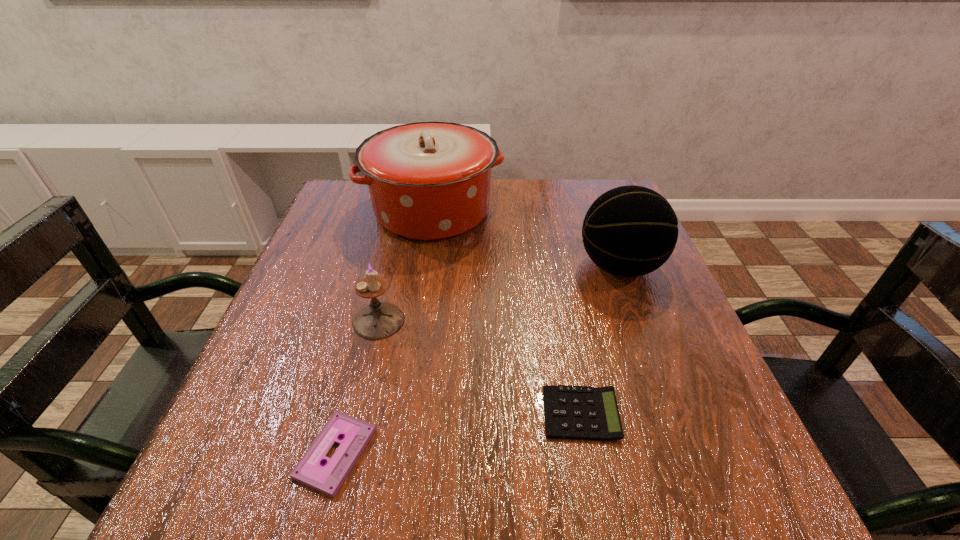
Locate an element on the screen. free space between the shortest object and the basketball is located at coordinates (478, 360).

Identify the location of vacant region between the third shortest object and the shortest object. (357, 387).

This screenshot has width=960, height=540. What are the coordinates of `object that is the closest to the third tallest object` in the screenshot? It's located at (327, 478).

The width and height of the screenshot is (960, 540). I want to click on object that is the second closest to the basketball, so click(571, 412).

Find the location of `vacant region that satisfies the following two spatial constraints: 1. on the back side of the second shortest object; 2. on the right side of the shortest object`. vacant region that satisfies the following two spatial constraints: 1. on the back side of the second shortest object; 2. on the right side of the shortest object is located at coordinates (346, 414).